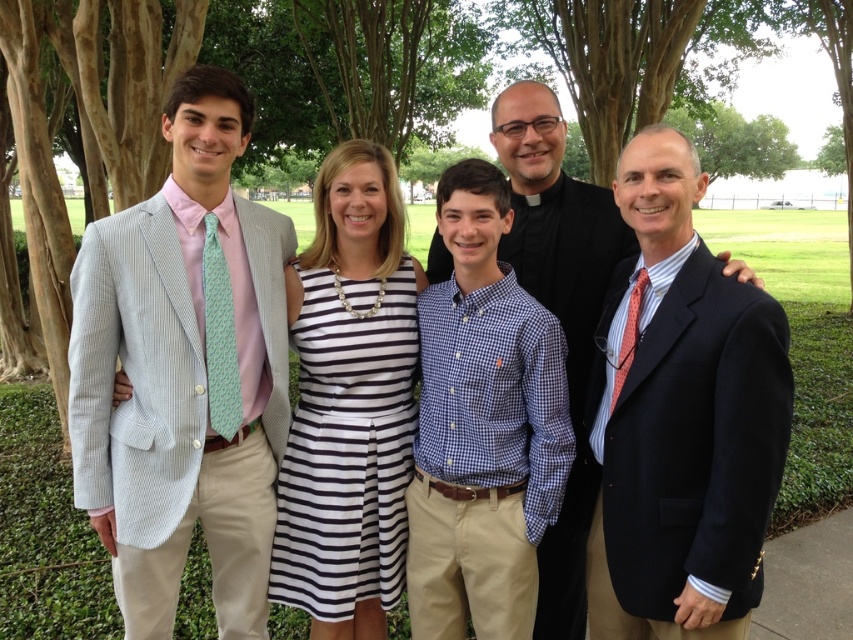
Who is lower down, dark blue suit at center or blue checkered shirt at center?

Positioned lower is dark blue suit at center.

The height and width of the screenshot is (640, 853). Find the location of `dark blue suit at center`. dark blue suit at center is located at coordinates (682, 419).

Is point (630, 369) less distant than point (549, 412)?

Yes, point (630, 369) is in front of point (549, 412).

Where is `dark blue suit at center`? dark blue suit at center is located at coordinates point(682,419).

Can you confirm if light gray seersucker suit at left is taller than matte black suit at center?

Incorrect, light gray seersucker suit at left's height is not larger of matte black suit at center's.

Is the position of light gray seersucker suit at left less distant than that of matte black suit at center?

Yes, it is.

Locate an element on the screen. The image size is (853, 640). light gray seersucker suit at left is located at coordinates (184, 371).

Which of these two, light gray seersucker suit at left or dark blue suit at center, stands shorter?

dark blue suit at center

Is point (287, 248) more distant than point (732, 305)?

Yes, point (287, 248) is farther from viewer.

The height and width of the screenshot is (640, 853). Find the location of `light gray seersucker suit at left`. light gray seersucker suit at left is located at coordinates (184, 371).